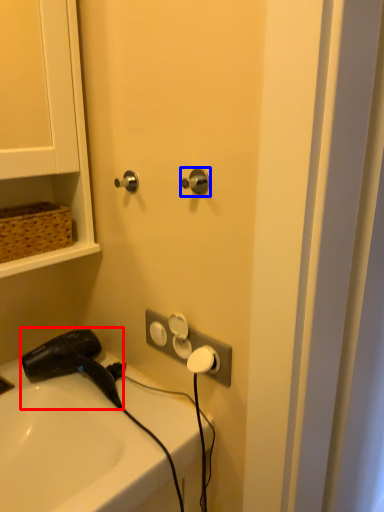
Question: Which object appears closest to the camera in this image, hair drier (highlighted by a red box) or door handle (highlighted by a blue box)?

Choices:
 (A) hair drier
 (B) door handle

Answer: (B)